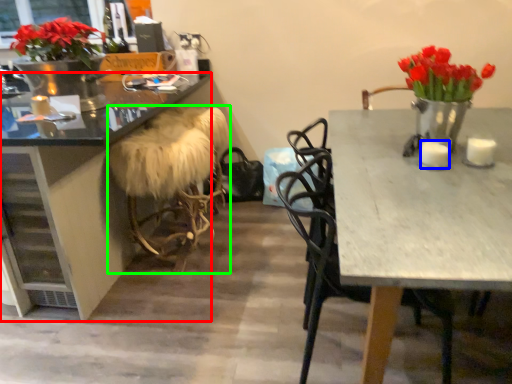
Question: Considering the real-world distances, which object is closest to desk (highlighted by a red box)? candle (highlighted by a blue box) or stool (highlighted by a green box).

Choices:
 (A) candle
 (B) stool

Answer: (B)